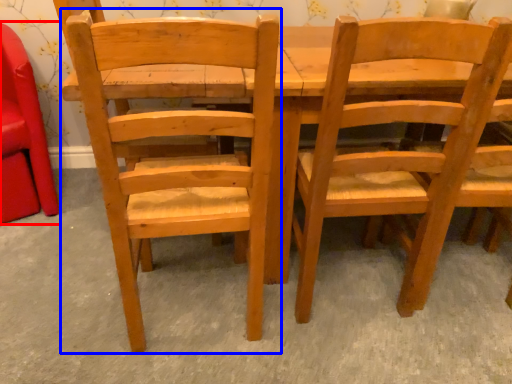
Question: Which object is further to the camera taking this photo, chair (highlighted by a red box) or chair (highlighted by a blue box)?

Choices:
 (A) chair
 (B) chair

Answer: (A)